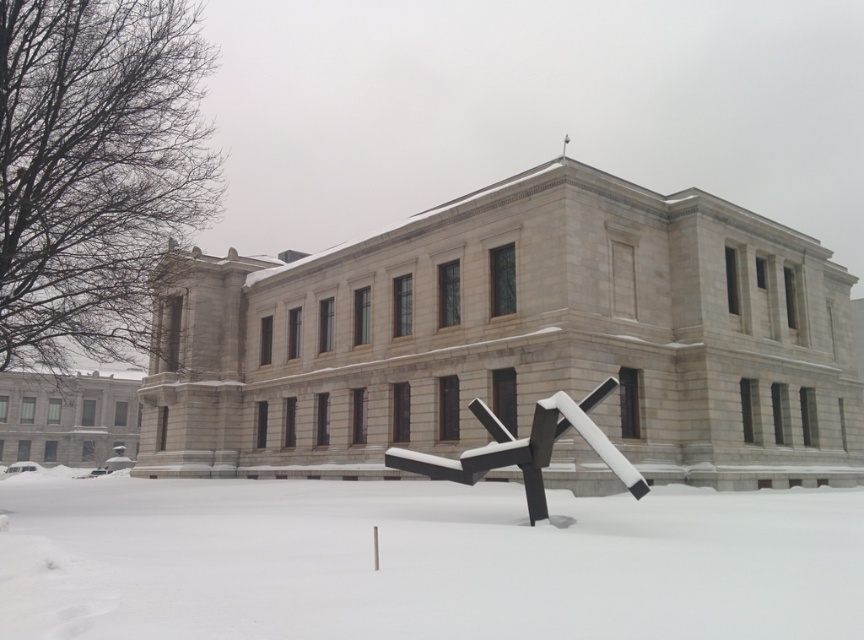
Who is taller, white powdery snow at center or black matte sculpture at center?

With more height is white powdery snow at center.

Does white powdery snow at center have a lesser width compared to black matte sculpture at center?

No, white powdery snow at center is not thinner than black matte sculpture at center.

This screenshot has height=640, width=864. Identify the location of white powdery snow at center. (422, 561).

Image resolution: width=864 pixels, height=640 pixels. Identify the location of white powdery snow at center. (422, 561).